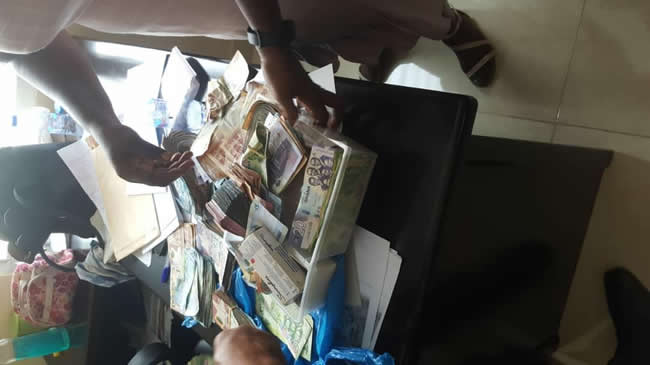
Find the location of a particular element. The image size is (650, 365). papers is located at coordinates (136, 231).